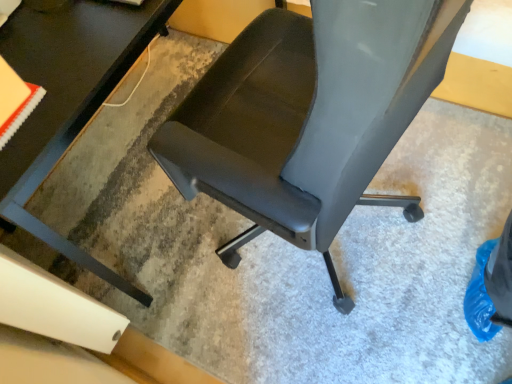
Question: In terms of width, does matte black chair at center look wider or thinner when compared to black glossy table at center?

Choices:
 (A) thin
 (B) wide

Answer: (A)

Question: Is matte black chair at center to the left or to the right of black glossy table at center in the image?

Choices:
 (A) left
 (B) right

Answer: (B)

Question: Does point [x=317, y=144] appear closer or farther from the camera than point [x=99, y=82]?

Choices:
 (A) farther
 (B) closer

Answer: (B)

Question: Is black glossy table at center wider or thinner than matte black chair at center?

Choices:
 (A) wide
 (B) thin

Answer: (A)

Question: Relative to matte black chair at center, is black glossy table at center in front or behind?

Choices:
 (A) behind
 (B) front

Answer: (A)

Question: Does point (1, 185) appear closer or farther from the camera than point (378, 54)?

Choices:
 (A) farther
 (B) closer

Answer: (A)

Question: From a real-world perspective, is black glossy table at center positioned above or below matte black chair at center?

Choices:
 (A) above
 (B) below

Answer: (B)